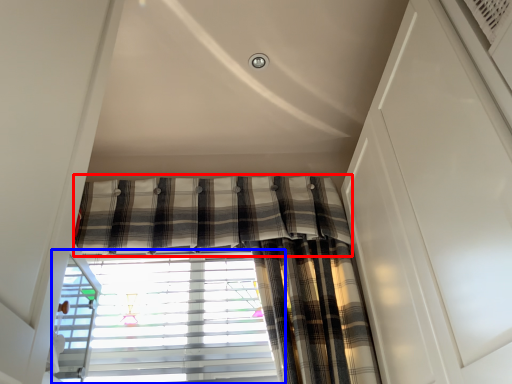
Question: Among these objects, which one is nearest to the camera, curtain (highlighted by a red box) or window blind (highlighted by a blue box)?

Choices:
 (A) curtain
 (B) window blind

Answer: (B)